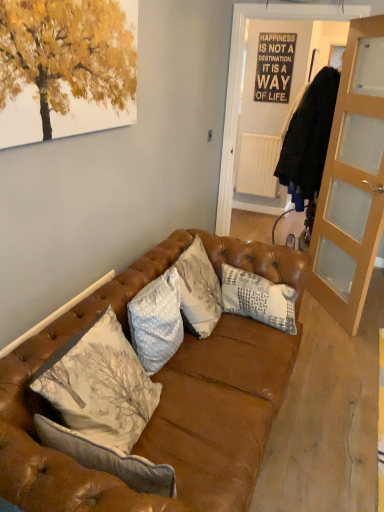
Question: Visually, is light brown glass cabinet at right positioned to the left or to the right of leather couch at center?

Choices:
 (A) right
 (B) left

Answer: (A)

Question: From a real-world perspective, relative to leather couch at center, is light brown glass cabinet at right vertically above or below?

Choices:
 (A) above
 (B) below

Answer: (A)

Question: Considering the real-world distances, which object is farthest from the light brown glass cabinet at right?

Choices:
 (A) black paper poster at upper center
 (B) light gray textured pillow at center, acting as the 1th pillow starting from the left
 (C) leather couch at center
 (D) gray textured pillow at center, the first pillow positioned from the right
 (E) white matte radiator at center

Answer: (A)

Question: Which of these objects is positioned farthest from the light brown glass cabinet at right?

Choices:
 (A) light gray textured pillow at center, acting as the 1th pillow starting from the left
 (B) gray textured pillow at center, which is the first pillow in back-to-front order
 (C) leather couch at center
 (D) white matte radiator at center
 (E) black paper poster at upper center

Answer: (E)